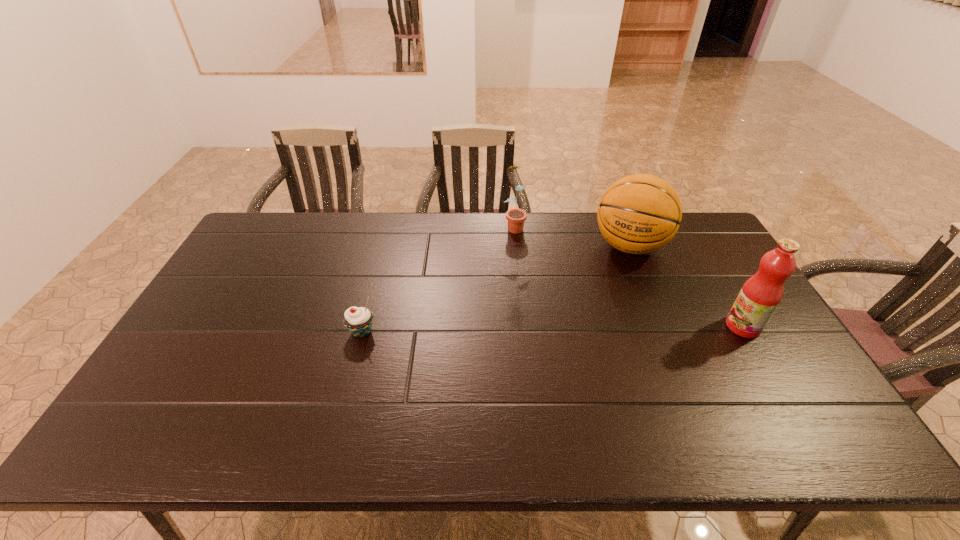
Identify the location of free spot on the desktop that is between the shortest object and the rightmost object and is positioned on the flower of the second object from left to right. The width and height of the screenshot is (960, 540). (561, 329).

The image size is (960, 540). In order to click on vacant space on the desktop that is between the shortest object and the fruit juice and is positioned on the surface of the third object from left to right near the brand logo in this screenshot , I will do `click(601, 328)`.